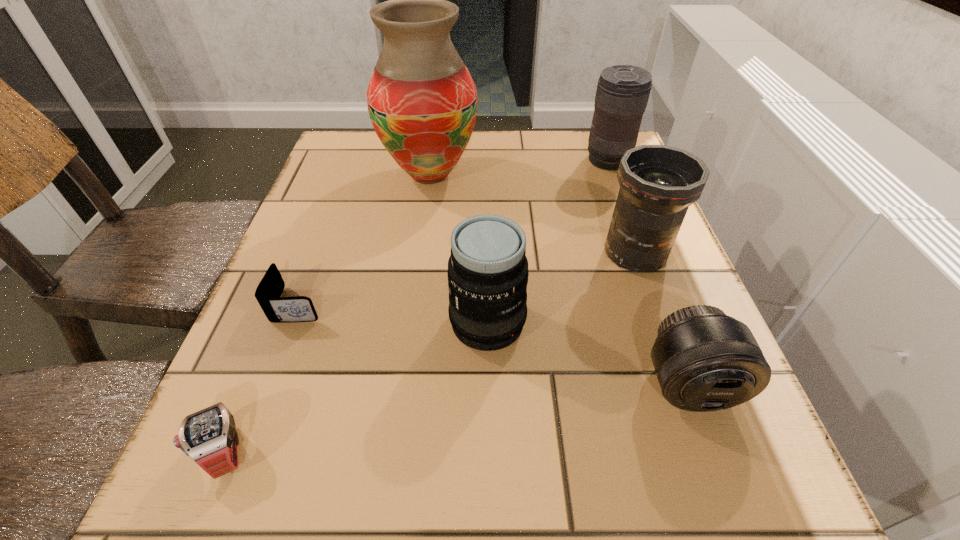
The image size is (960, 540). What are the coordinates of `the tallest object` in the screenshot? It's located at (422, 101).

Identify the location of the farthest telephoto lens. click(622, 94).

Identify the location of the third nearest telephoto lens. (658, 183).

You are a GUI agent. You are given a task and a screenshot of the screen. Output one action in this format:
    pyautogui.click(x=<x>, y=<y>)
    Task: Click on the leftmost telephoto lens
    
    Given the screenshot: What is the action you would take?
    pyautogui.click(x=487, y=273)

Find the location of a particular element. the shortest telephoto lens is located at coordinates (704, 360).

The width and height of the screenshot is (960, 540). What are the coordinates of `watch` in the screenshot? It's located at (209, 437).

This screenshot has height=540, width=960. Find the location of `the shortest object`. the shortest object is located at coordinates (277, 309).

Find the location of a particular element. This screenshot has height=540, width=960. vacant area located 0.140m on the right of the vase is located at coordinates (537, 174).

I want to click on vacant space located on the side of the farthest telephoto lens where the control switches are located, so click(x=476, y=160).

Identify the location of vacant area located on the side of the farthest telephoto lens where the control switches are located. (444, 160).